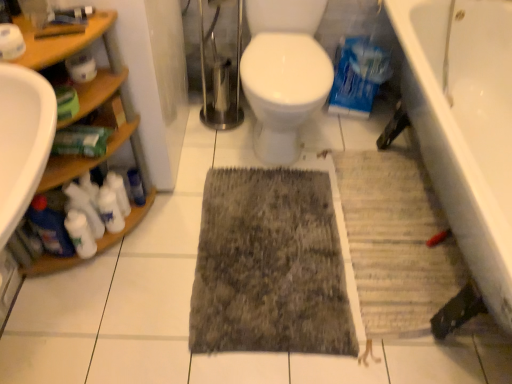
You are a GUI agent. You are given a task and a screenshot of the screen. Output one action in this format:
    pyautogui.click(x=<x>, y=<y>)
    Task: Click on the vacant point above gray textured bath mat at lower right (from a real-world perspective)
    This screenshot has width=512, height=384.
    Given the screenshot: What is the action you would take?
    pyautogui.click(x=416, y=255)